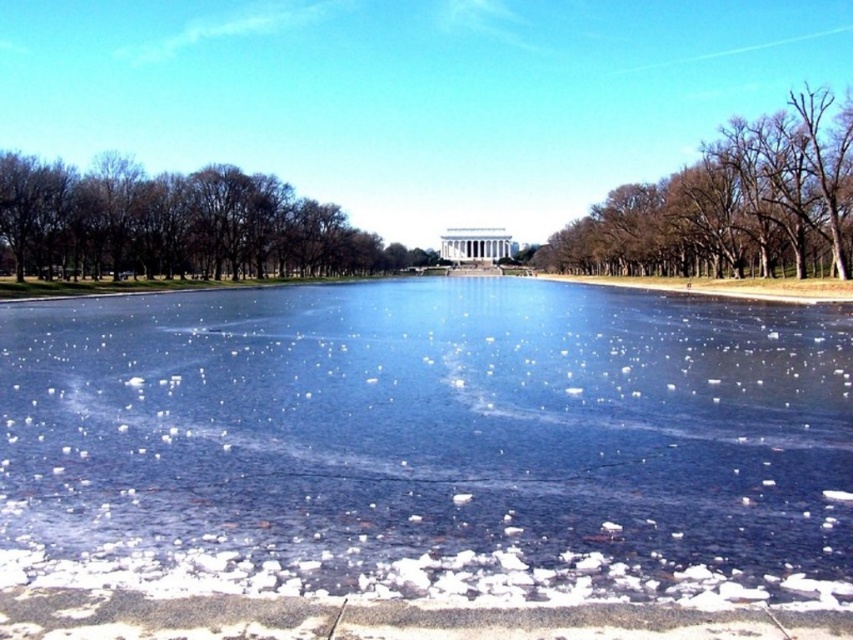
Question: Among these points, which one is farthest from the camera?

Choices:
 (A) (218, 237)
 (B) (540, 262)
 (C) (619, 387)

Answer: (B)

Question: Is brown leafless trees at left positioned at the back of bare brown tree at upper right?

Choices:
 (A) no
 (B) yes

Answer: (B)

Question: Is the position of transparent ice at center less distant than that of bare brown tree at upper right?

Choices:
 (A) yes
 (B) no

Answer: (A)

Question: Does transparent ice at center have a greater width compared to brown leafless trees at left?

Choices:
 (A) no
 (B) yes

Answer: (B)

Question: Among these objects, which one is nearest to the camera?

Choices:
 (A) bare brown tree at upper right
 (B) brown leafless trees at left
 (C) transparent ice at center

Answer: (C)

Question: Which object is the closest to the brown leafless trees at left?

Choices:
 (A) bare brown tree at upper right
 (B) transparent ice at center

Answer: (A)